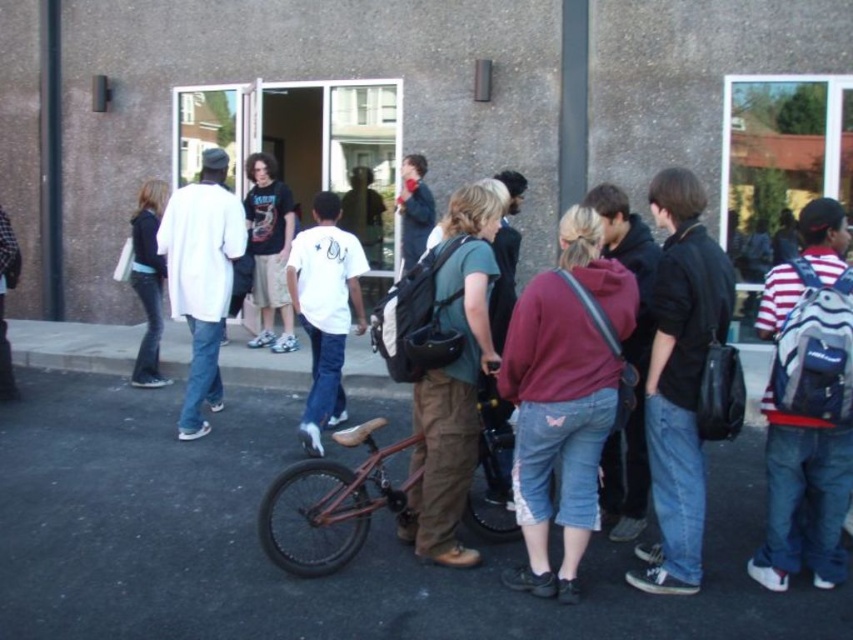
Based on the photo, does green fabric backpack at center have a greater width compared to shiny brown bicycle at center?

Incorrect, green fabric backpack at center's width does not surpass shiny brown bicycle at center's.

Does point (468, 312) lie in front of point (287, 506)?

Yes.

Is point (468, 291) positioned after point (288, 548)?

No.

At what (x,y) coordinates should I click in order to perform the action: click on green fabric backpack at center. Please return your answer as a coordinate pair (x, y). This screenshot has width=853, height=640. Looking at the image, I should click on (454, 381).

Who is higher up, shiny brown bicycle at center or white matte t-shirt at center?

white matte t-shirt at center

Which is more to the left, shiny brown bicycle at center or white matte t-shirt at center?

From the viewer's perspective, white matte t-shirt at center appears more on the left side.

Identify the location of shiny brown bicycle at center. (334, 502).

Where is `shiny brown bicycle at center`? shiny brown bicycle at center is located at coordinates (334, 502).

Is green fabric backpack at center shorter than white matte t-shirt at center?

Indeed, green fabric backpack at center has a lesser height compared to white matte t-shirt at center.

Does green fabric backpack at center have a smaller size compared to white matte t-shirt at center?

Yes, green fabric backpack at center is smaller than white matte t-shirt at center.

Describe the element at coordinates (454, 381) in the screenshot. This screenshot has height=640, width=853. I see `green fabric backpack at center` at that location.

Locate an element on the screen. The height and width of the screenshot is (640, 853). green fabric backpack at center is located at coordinates (454, 381).